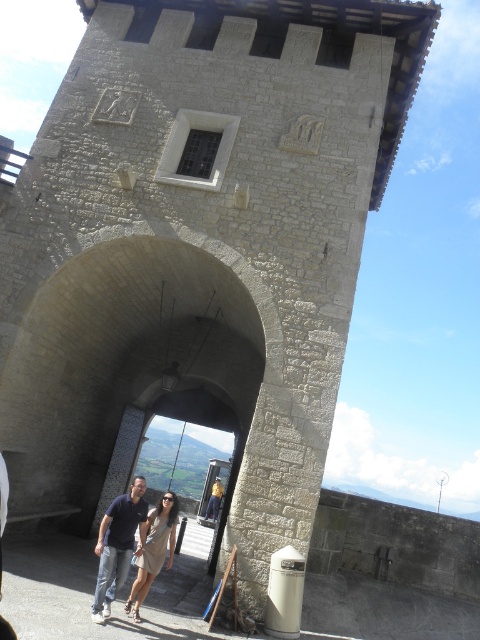
You are standing at the entrance of the historic stone structure and see two people approaching you. The first person is wearing a dark blue shirt at center and the second is wearing a light beige dress at center. Which of the two is closer to you?

The dark blue shirt at center is below light beige dress at center, indicating that the person in the light beige dress at center is closer to you.

You are standing at the historic stone structure and want to take a photo of the two people walking towards you. Which of the two points, point 1 at coordinates [145,500] or point 2 at coordinates [133,621], should you focus on to ensure the person behind them is in the frame?

Point 1 at coordinates [145,500] is behind point 2 at coordinates [133,621], so focusing on point 1 would include the person behind in the frame.